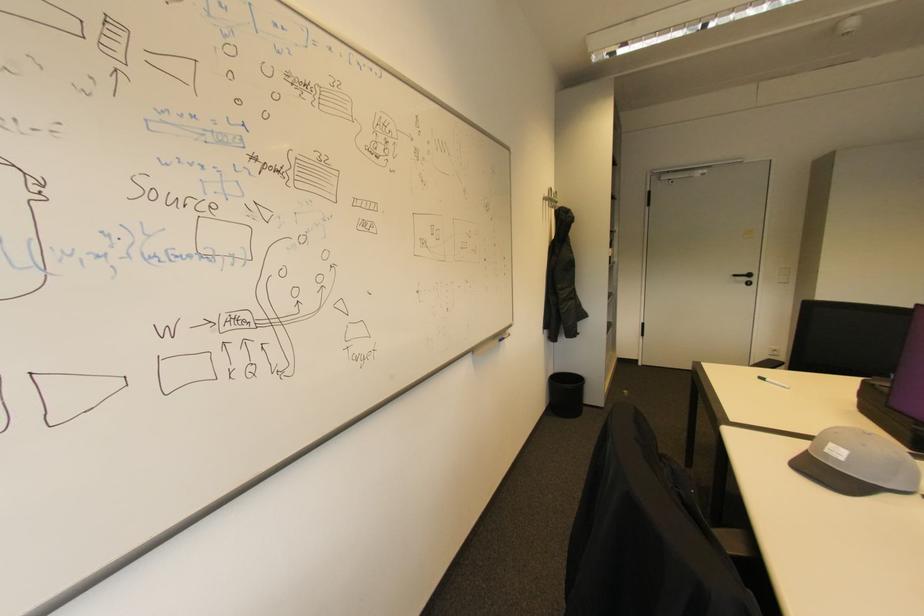
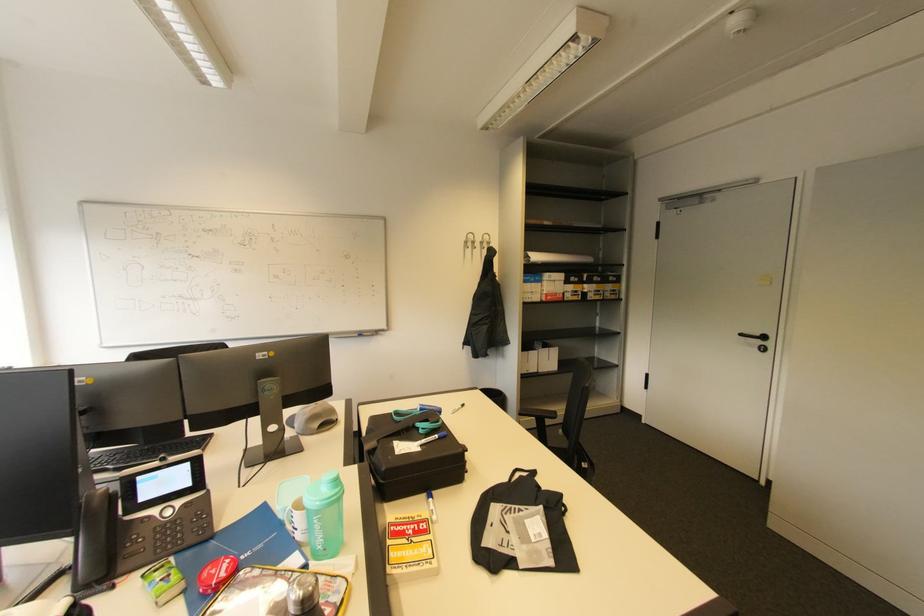
The point at [755,276] is marked in the first image. Where is the corresponding point in the second image?

(769, 339)